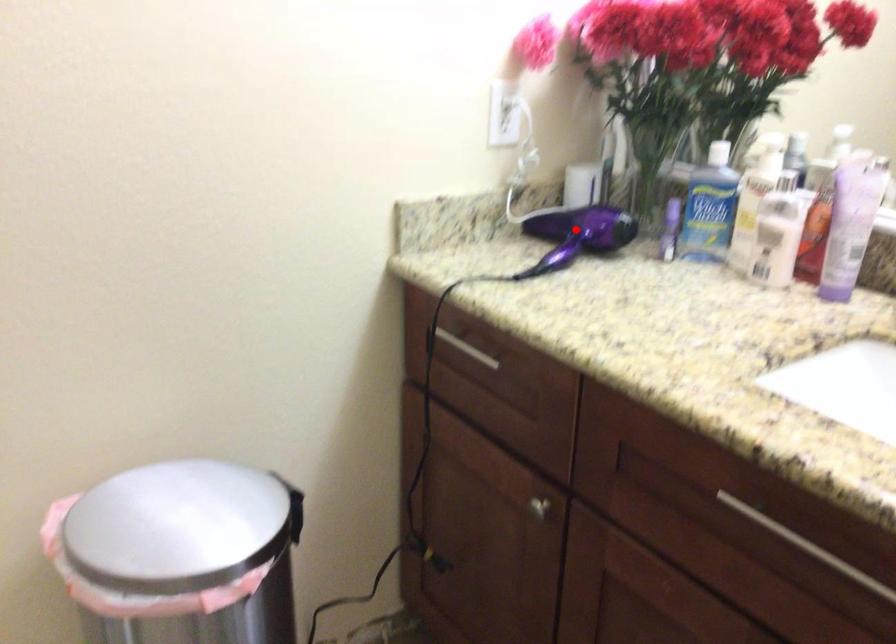
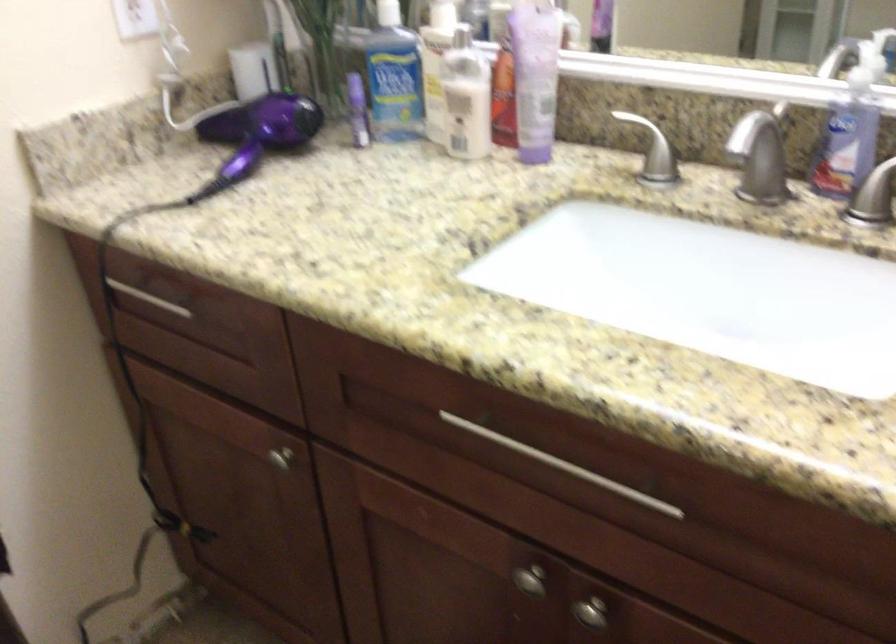
Question: I am providing you with two images of the same scene from different viewpoints. Given a red point in image1, look at the same physical point in image2. Is it:

Choices:
 (A) Closer to the viewpoint
 (B) Farther from the viewpoint

Answer: (A)